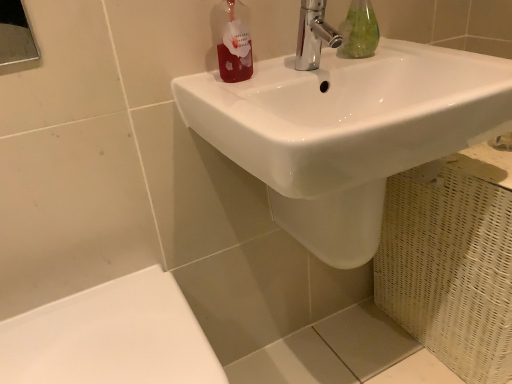
Where is `free space to the right of chrome/metallic faucet at upper center`? The height and width of the screenshot is (384, 512). free space to the right of chrome/metallic faucet at upper center is located at coordinates (406, 58).